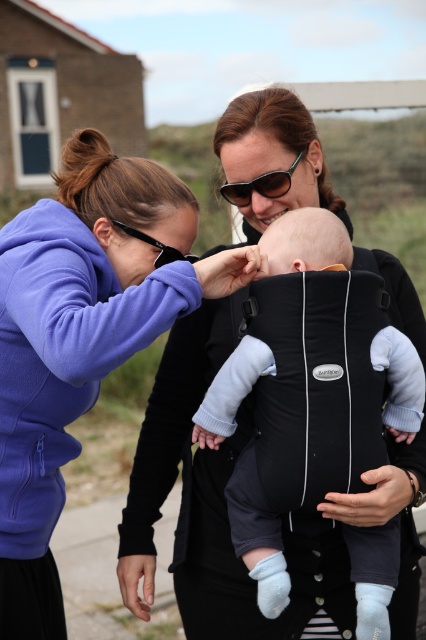
Question: Which of these objects is positioned farthest from the purple fleece sweatshirt at left?

Choices:
 (A) sunglasses at center
 (B) black plastic goggles at upper center

Answer: (A)

Question: Does purple fleece sweatshirt at left appear under black fabric carrier at center?

Choices:
 (A) no
 (B) yes

Answer: (A)

Question: Is black fabric carrier at center smaller than sunglasses at center?

Choices:
 (A) yes
 (B) no

Answer: (B)

Question: Which point is farther to the camera?

Choices:
 (A) (236, 196)
 (B) (158, 241)
 (C) (36, 513)
 (D) (278, 260)

Answer: (A)

Question: Does black fabric carrier at center come in front of sunglasses at center?

Choices:
 (A) yes
 (B) no

Answer: (A)

Question: Which object appears farthest from the camera in this image?

Choices:
 (A) black plastic goggles at upper center
 (B) sunglasses at center
 (C) purple fleece sweatshirt at left

Answer: (B)